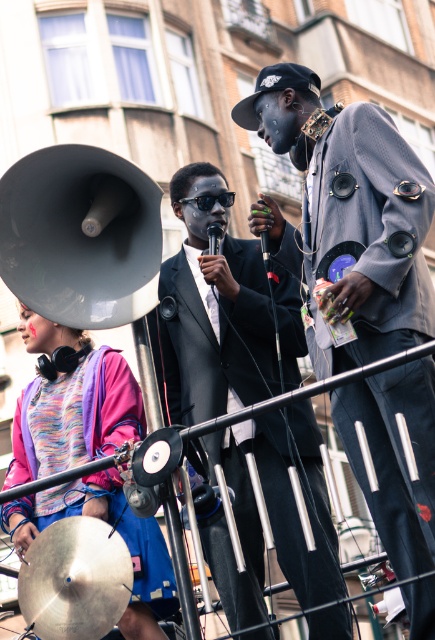
You are a photographer standing at the front of the stage. You want to take a photo that includes both the matte gray jacket at center and the shiny silver cymbal at lower left. Based on their positions, which object should you adjust your camera to focus on first to ensure both are in frame?

The matte gray jacket at center is to the right of the shiny silver cymbal at lower left. To include both in the frame, focus on the shiny silver cymbal at lower left first since it is positioned to the left, then adjust to include the matte gray jacket at center on the right side of the frame.

You are a stagehand setting up for a performance. You need to place a new decorative item on the stage. The multicolored fabric at lower left and the shiny silver cymbal at lower left are already present. Where should you place the new item so it doesn

The multicolored fabric at lower left is located above the shiny silver cymbal at lower left. To place the new item between them, position it below the multicolored fabric at lower left but above the shiny silver cymbal at lower left.